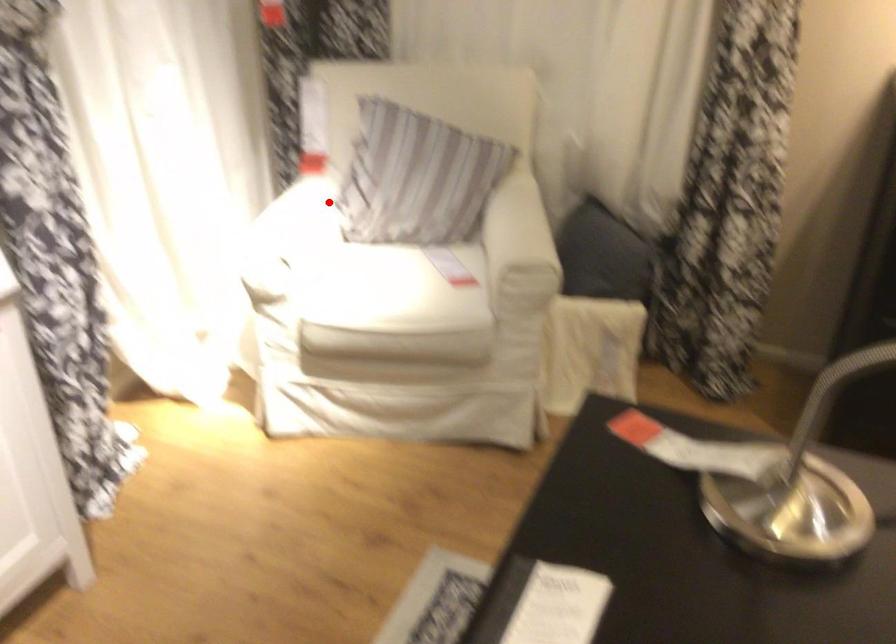
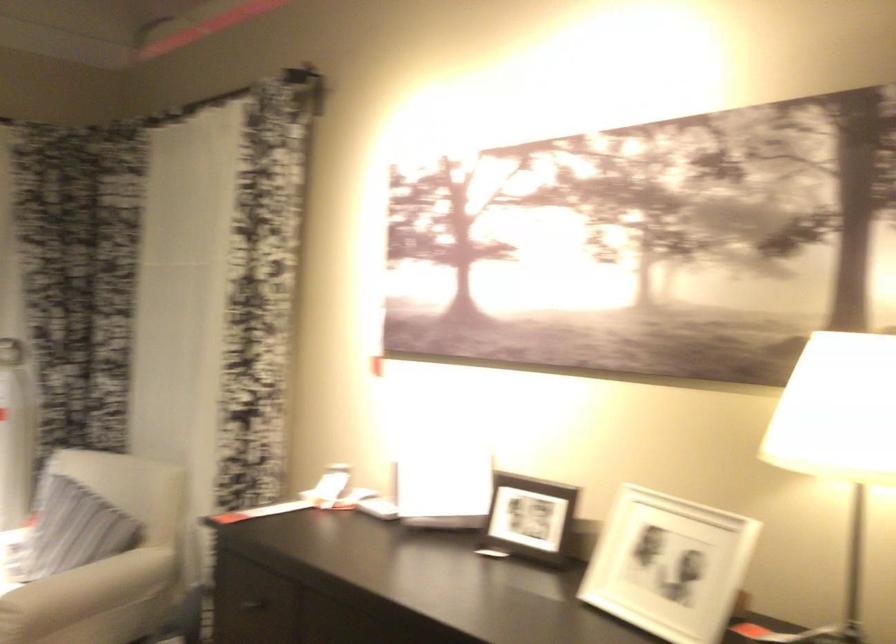
In the second image, find the point that corresponds to the highlighted location in the first image.

(15, 540)